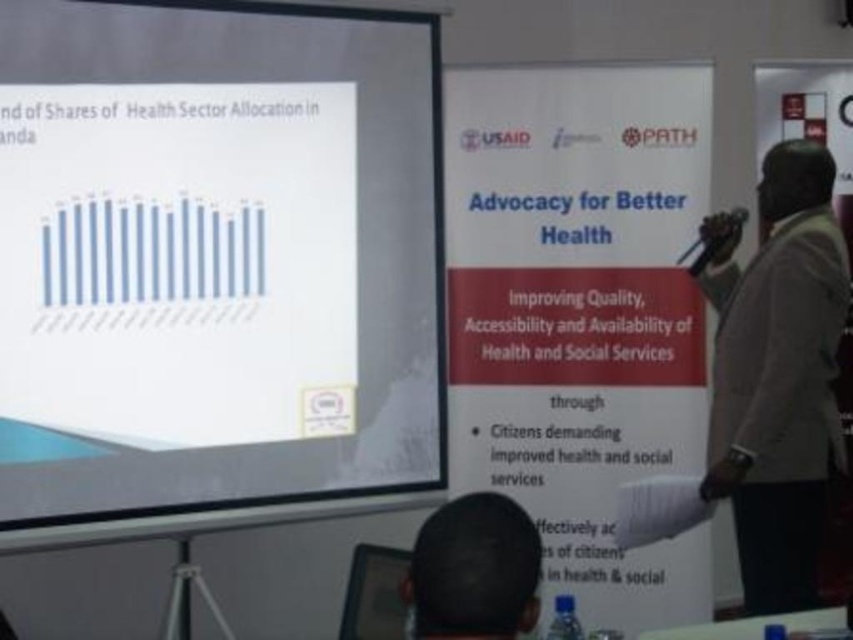
Question: Which point is closer to the camera taking this photo?

Choices:
 (A) (10, 307)
 (B) (799, 220)

Answer: (A)

Question: Does brown fabric jacket at right appear on the right side of dark hair at lower center?

Choices:
 (A) no
 (B) yes

Answer: (B)

Question: Is brown fabric jacket at right in front of dark hair at lower center?

Choices:
 (A) yes
 (B) no

Answer: (B)

Question: Considering the relative positions of white matte projection screen at upper left and dark hair at lower center in the image provided, where is white matte projection screen at upper left located with respect to dark hair at lower center?

Choices:
 (A) below
 (B) above

Answer: (B)

Question: Which point is closer to the camera?

Choices:
 (A) click(x=27, y=42)
 (B) click(x=718, y=396)
 (C) click(x=526, y=544)

Answer: (C)

Question: Estimate the real-world distances between objects in this image. Which object is closer to the brown fabric jacket at right?

Choices:
 (A) white matte projection screen at upper left
 (B) dark hair at lower center

Answer: (A)